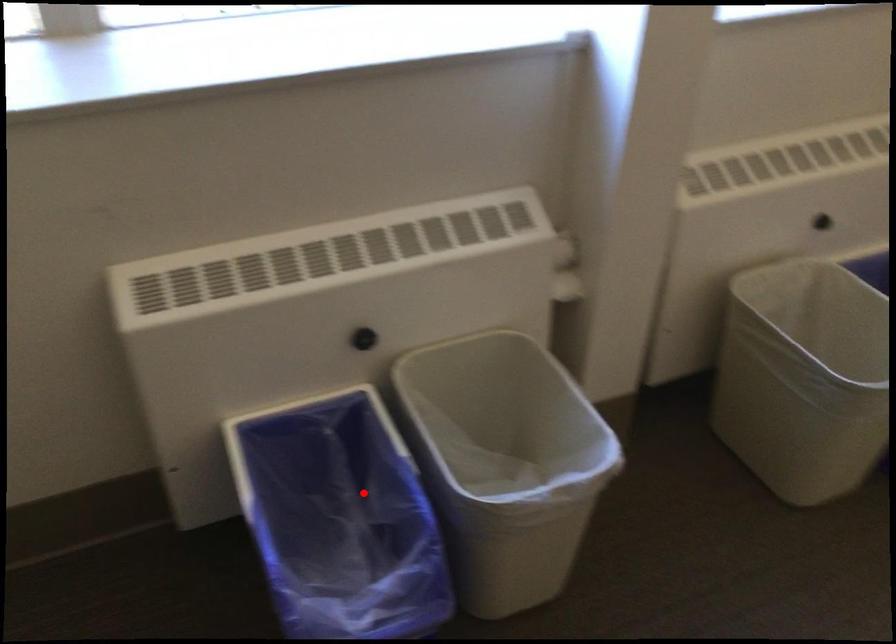
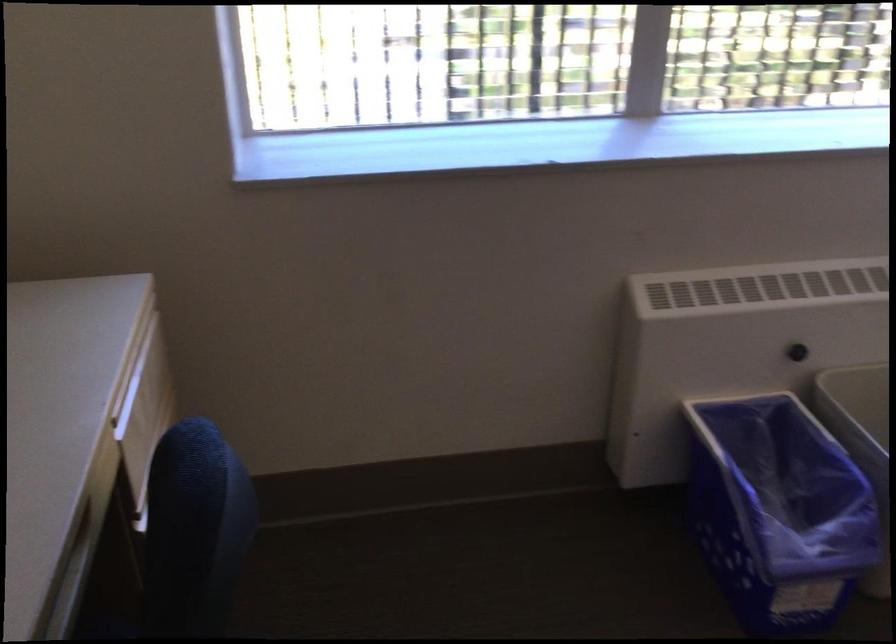
Locate, in the second image, the point that corresponds to the highlighted location in the first image.

(776, 476)